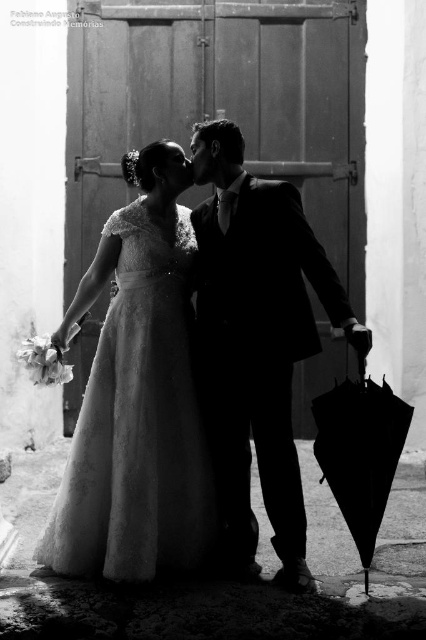
Question: Is satin white gown at center in front of black matte umbrella at lower right?

Choices:
 (A) yes
 (B) no

Answer: (B)

Question: Does satin white gown at center appear over satin black suit at center?

Choices:
 (A) yes
 (B) no

Answer: (B)

Question: Among these points, which one is nearest to the camera?

Choices:
 (A) (132, 541)
 (B) (344, 384)
 (C) (282, 448)

Answer: (A)

Question: Which point appears closest to the camera in this image?

Choices:
 (A) (374, 486)
 (B) (238, 417)
 (C) (129, 349)

Answer: (A)

Question: Does satin white gown at center appear on the left side of black matte umbrella at lower right?

Choices:
 (A) no
 (B) yes

Answer: (B)

Question: Which object appears closest to the camera in this image?

Choices:
 (A) black matte umbrella at lower right
 (B) satin white gown at center
 (C) satin black suit at center

Answer: (A)